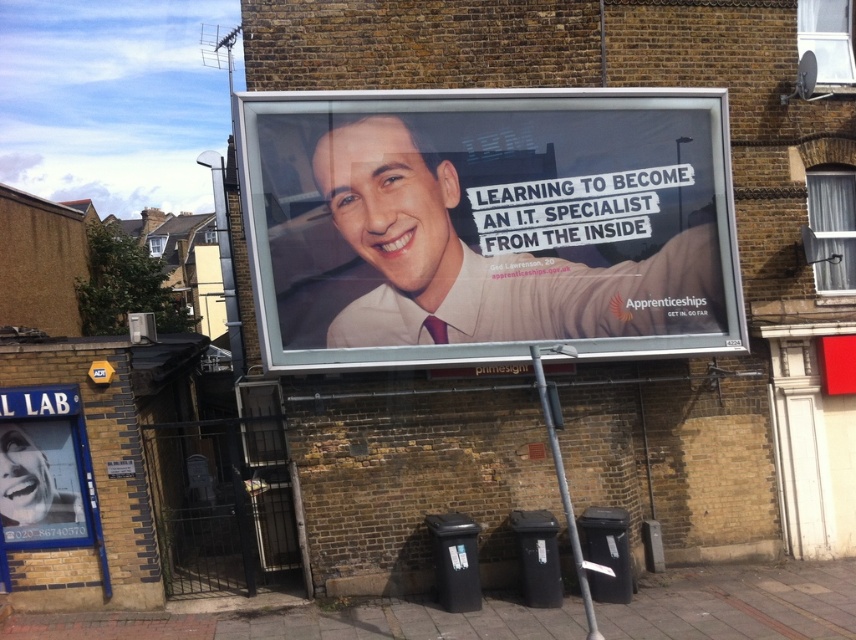
Question: Which point is closer to the camera?

Choices:
 (A) (343, 156)
 (B) (55, 536)

Answer: (A)

Question: Which point is closer to the camera?

Choices:
 (A) white glossy billboard at center
 (B) white glossy poster at lower left

Answer: (A)

Question: Can you confirm if white glossy billboard at center is bigger than white glossy poster at lower left?

Choices:
 (A) yes
 (B) no

Answer: (A)

Question: Does white glossy billboard at center appear on the left side of white glossy poster at lower left?

Choices:
 (A) no
 (B) yes

Answer: (A)

Question: Does white glossy billboard at center have a greater width compared to white glossy poster at lower left?

Choices:
 (A) yes
 (B) no

Answer: (A)